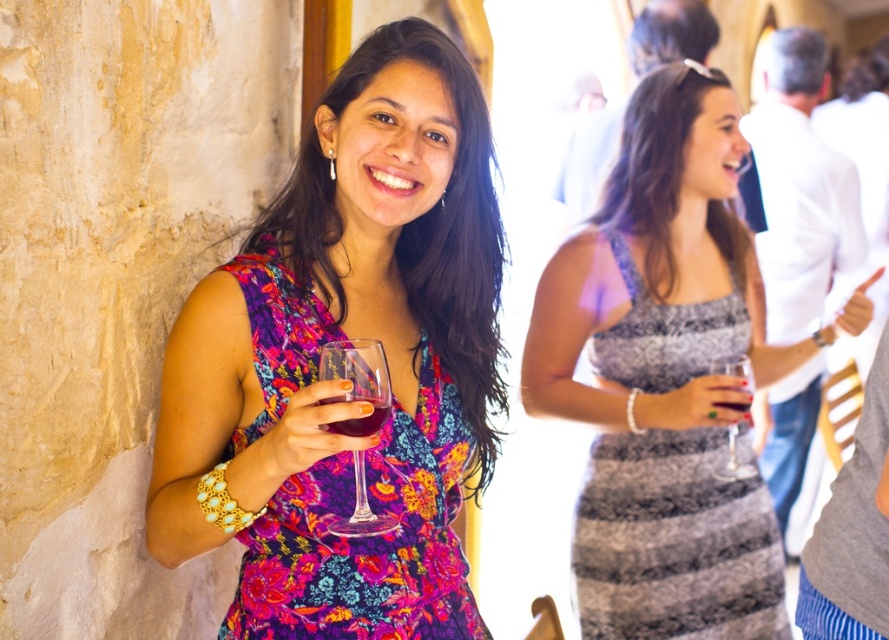
Does translucent glass wine at center come behind translucent glass at center?

No, it is in front of translucent glass at center.

Is translucent glass wine at center bigger than translucent glass at center?

Correct, translucent glass wine at center is larger in size than translucent glass at center.

The image size is (889, 640). Find the location of `translucent glass wine at center`. translucent glass wine at center is located at coordinates coord(359,417).

Is point (245, 385) closer to camera compared to point (733, 406)?

Yes, it is.

Is floral fabric dress at center thinner than translucent glass at center?

Incorrect, floral fabric dress at center's width is not less than translucent glass at center's.

Between point (279, 417) and point (725, 406), which one is positioned in front?

Point (279, 417) is in front.

At what (x,y) coordinates should I click in order to perform the action: click on floral fabric dress at center. Please return your answer as a coordinate pair (x, y). The image size is (889, 640). Looking at the image, I should click on (341, 381).

Is gray lace dress at upper center positioned in front of gray textured dress at center?

Yes, gray lace dress at upper center is in front of gray textured dress at center.

This screenshot has height=640, width=889. Identify the location of gray lace dress at upper center. (667, 369).